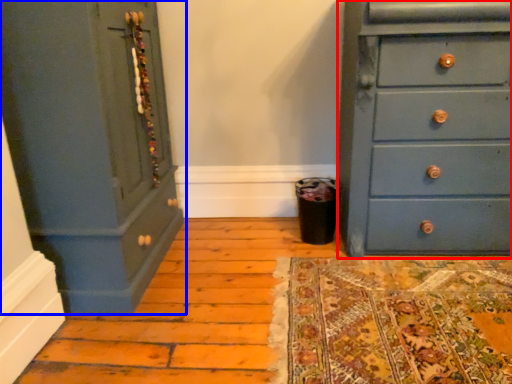
Question: Which point is closer to the camera, chest of drawers (highlighted by a red box) or chest of drawers (highlighted by a blue box)?

Choices:
 (A) chest of drawers
 (B) chest of drawers

Answer: (B)